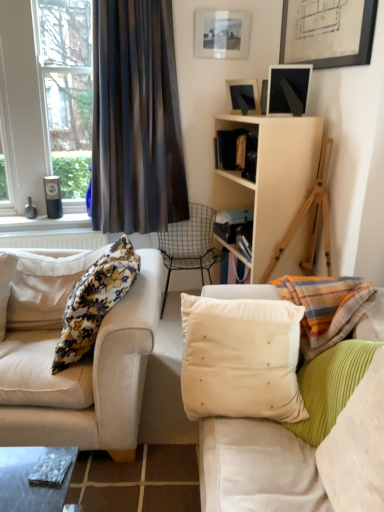
Question: From a real-world perspective, is beige velvet cushion at center, the second pillow in the right-to-left sequence, on wire mesh chair at center?

Choices:
 (A) yes
 (B) no

Answer: (A)

Question: Can you confirm if beige velvet cushion at center, the second pillow in the right-to-left sequence, is shorter than wire mesh chair at center?

Choices:
 (A) no
 (B) yes

Answer: (B)

Question: From the image's perspective, would you say beige velvet cushion at center, the 2th pillow positioned from the left, is positioned over wire mesh chair at center?

Choices:
 (A) yes
 (B) no

Answer: (B)

Question: Can we say beige velvet cushion at center, the second pillow in the right-to-left sequence, lies outside wire mesh chair at center?

Choices:
 (A) yes
 (B) no

Answer: (A)

Question: Considering the relative sizes of beige velvet cushion at center, the second pillow in the right-to-left sequence, and wire mesh chair at center in the image provided, is beige velvet cushion at center, the second pillow in the right-to-left sequence, wider than wire mesh chair at center?

Choices:
 (A) yes
 (B) no

Answer: (B)

Question: Is beige velvet cushion at center, the second pillow in the right-to-left sequence, with wire mesh chair at center?

Choices:
 (A) no
 (B) yes

Answer: (A)

Question: Does matte black picture frame at upper right, marked as the 3th picture frame in a top-to-bottom arrangement, appear on the left side of dark sheer curtain at left?

Choices:
 (A) yes
 (B) no

Answer: (B)

Question: Is matte black picture frame at upper right, marked as the 3th picture frame in a top-to-bottom arrangement, surrounding dark sheer curtain at left?

Choices:
 (A) yes
 (B) no

Answer: (B)

Question: Is matte black picture frame at upper right, which is the first picture frame from bottom to top, looking in the opposite direction of dark sheer curtain at left?

Choices:
 (A) no
 (B) yes

Answer: (A)

Question: Are matte black picture frame at upper right, marked as the 3th picture frame in a top-to-bottom arrangement, and dark sheer curtain at left located far from each other?

Choices:
 (A) yes
 (B) no

Answer: (B)

Question: From the image's perspective, does matte black picture frame at upper right, which is the first picture frame from bottom to top, appear lower than dark sheer curtain at left?

Choices:
 (A) yes
 (B) no

Answer: (B)

Question: Would you say matte black picture frame at upper right, which is the first picture frame from bottom to top, is outside dark sheer curtain at left?

Choices:
 (A) yes
 (B) no

Answer: (A)

Question: From a real-world perspective, is matte black picture frame at upper center, the second picture frame positioned from the top, located beneath floral fabric pillow at left, positioned as the 3th pillow in right-to-left order?

Choices:
 (A) no
 (B) yes

Answer: (A)